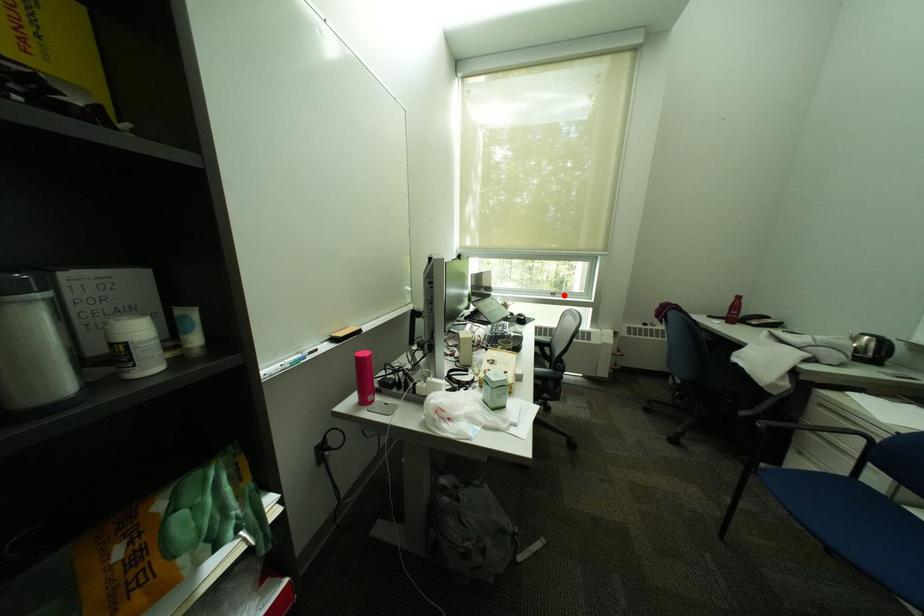
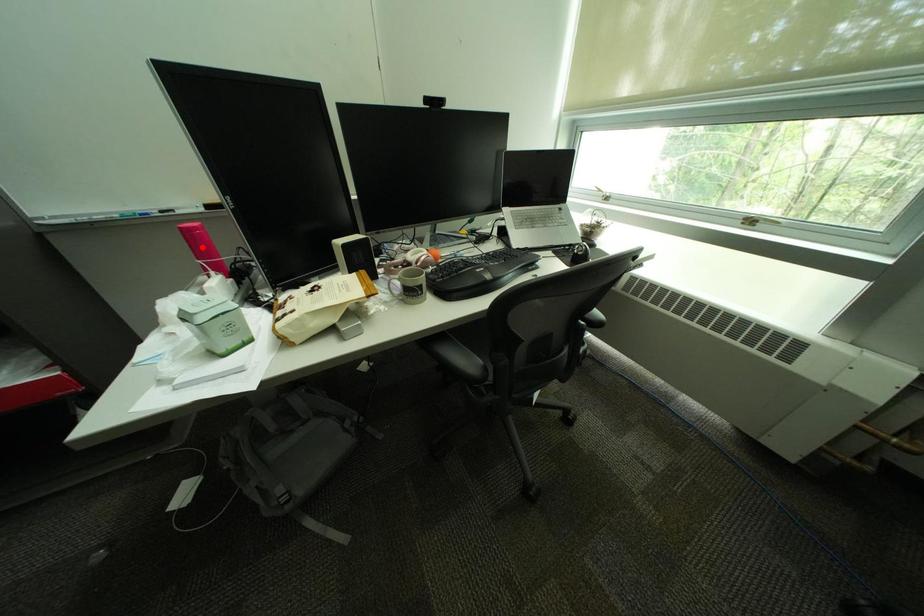
I am providing you with two images of the same scene from different viewpoints. A red point is marked on the first image and another point is marked on the second image. Are the points marked in image1 and image2 representing the same 3D position?

No